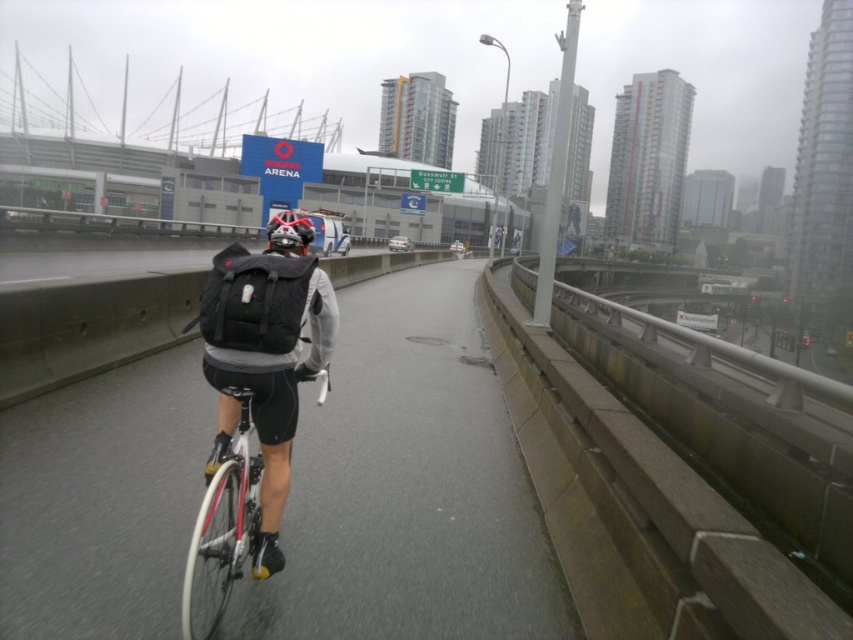
Question: Which point is closer to the camera?

Choices:
 (A) (135, 596)
 (B) (229, 307)

Answer: (B)

Question: Which of these objects is positioned closest to the shiny black helmet at center?

Choices:
 (A) matte black backpack at center
 (B) white matte bicycle at center

Answer: (B)

Question: Which object is farther from the camera taking this photo?

Choices:
 (A) shiny black helmet at center
 (B) matte black backpack at center
 (C) white asphalt road at center

Answer: (A)

Question: Can you confirm if matte black backpack at center is bigger than shiny black helmet at center?

Choices:
 (A) yes
 (B) no

Answer: (B)

Question: Does white asphalt road at center have a larger size compared to matte black backpack at center?

Choices:
 (A) no
 (B) yes

Answer: (B)

Question: Can you confirm if white asphalt road at center is smaller than matte black backpack at center?

Choices:
 (A) no
 (B) yes

Answer: (A)